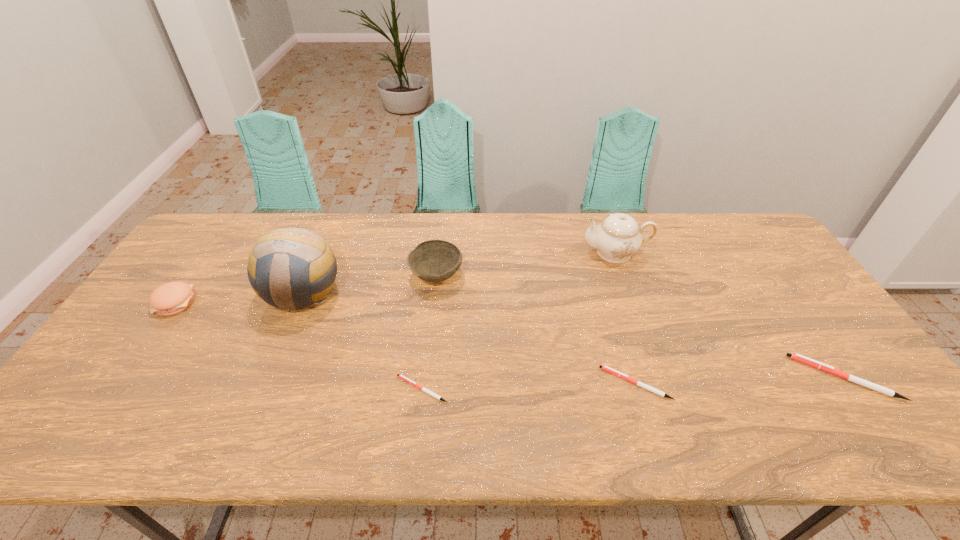
You are a GUI agent. You are given a task and a screenshot of the screen. Output one action in this format:
    pyautogui.click(x=<x>, y=<y>)
    Task: Click on the vacant area between the tallest pen and the shortest object
    The image size is (960, 540).
    Given the screenshot: What is the action you would take?
    pyautogui.click(x=634, y=383)

The image size is (960, 540). In order to click on vacant point located between the third tallest object and the second shortest object in this screenshot , I will do `click(536, 330)`.

The width and height of the screenshot is (960, 540). Identify the location of empty location between the chinaware and the shortest pen. (518, 321).

Identify the location of unoccupied position between the tallest object and the leftmost object. The height and width of the screenshot is (540, 960). (239, 298).

What are the coordinates of `object that is the closest to the leftmost object` in the screenshot? It's located at pos(282,260).

Identify which object is the second nearest to the patty. Please provide its 2D coordinates. Your answer should be formatted as a tuple, i.e. [(x, y)], where the tuple contains the x and y coordinates of a point satisfying the conditions above.

[(434, 260)]

In order to click on pen that is the closest to the leftmost object in this screenshot , I will do `click(404, 378)`.

Select which pen is the second closest to the leftmost object. Please provide its 2D coordinates. Your answer should be formatted as a tuple, i.e. [(x, y)], where the tuple contains the x and y coordinates of a point satisfying the conditions above.

[(608, 369)]

Identify the location of vacant area that satisfies the following two spatial constraints: 1. on the front side of the fifth shortest object; 2. on the clicker of the shortest pen. (424, 389).